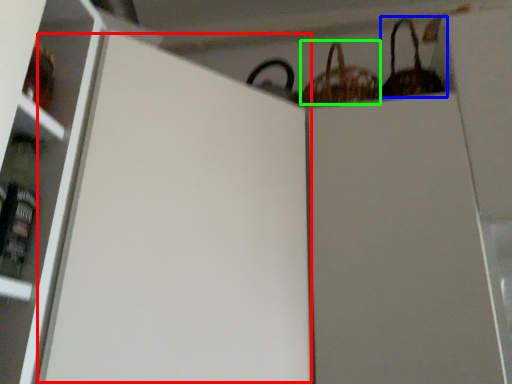
Question: Which is farther away from screen door (highlighted by a red box)? basket (highlighted by a blue box) or basket (highlighted by a green box)?

Choices:
 (A) basket
 (B) basket

Answer: (A)